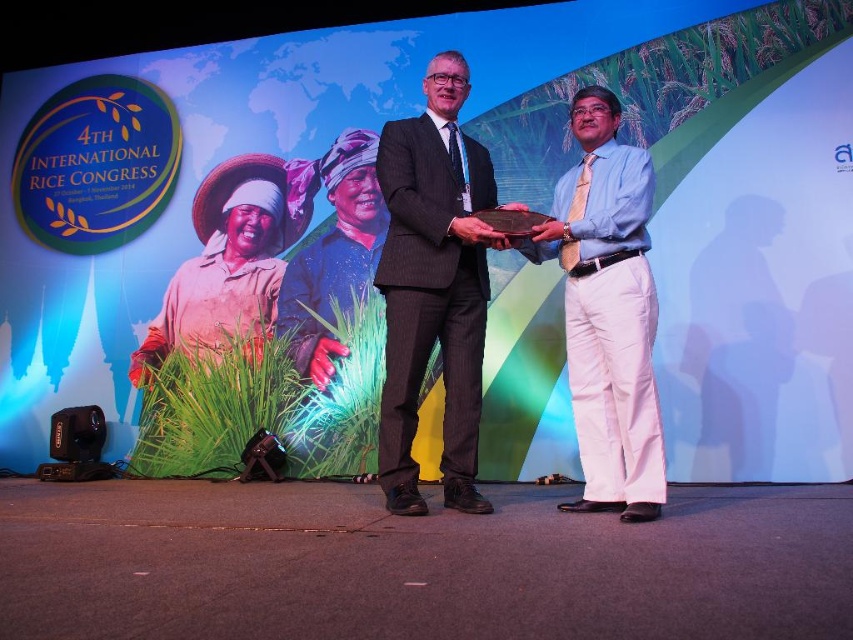
Can you confirm if matte black suit at center is thinner than light blue shirt at center?

No, matte black suit at center is not thinner than light blue shirt at center.

Is matte black suit at center behind light blue shirt at center?

Yes, matte black suit at center is further from the viewer.

Is point (397, 508) positioned in front of point (567, 291)?

Yes, it is in front of point (567, 291).

At what (x,y) coordinates should I click in order to perform the action: click on matte black suit at center. Please return your answer as a coordinate pair (x, y). Looking at the image, I should click on (433, 285).